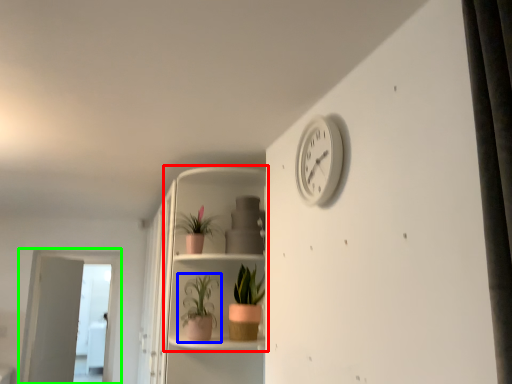
Question: Which object is the closest to the shelf (highlighted by a red box)? Choose among these: houseplant (highlighted by a blue box) or screen door (highlighted by a green box).

Choices:
 (A) houseplant
 (B) screen door

Answer: (A)